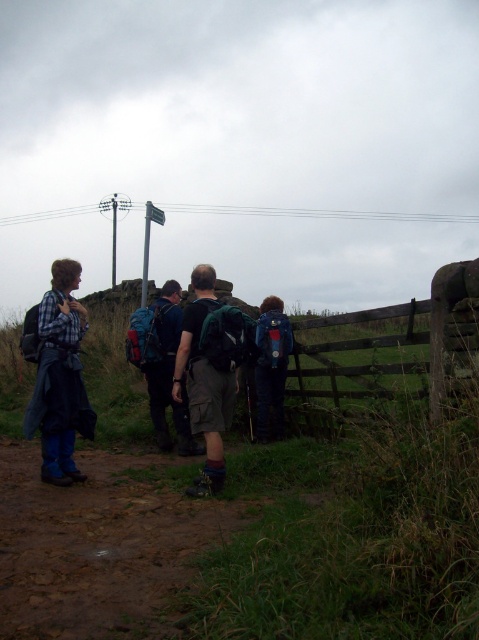
You are a hiker who wants to place a map marker on the exact center of the image. The map coordinates are given as a grid from 0 to 1 in both x and y directions. Where should you place the marker relative to the green canvas backpack at center?

The green canvas backpack at center is already positioned at the exact center coordinates of the image at point (208, 372), so the map marker should be placed there.

You are a hiker trying to locate your gear. You have a green canvas backpack at center and a green fabric backpack at center. Which one is positioned to the right?

The green canvas backpack at center is to the right of the green fabric backpack at center.

You are a hiker trying to decide which backpack to take from the two green ones at center. The green canvas backpack at center and the green fabric backpack at center are both available. Which one has a smaller height?

The green canvas backpack at center is shorter than the green fabric backpack at center, so the green canvas backpack at center has a smaller height.